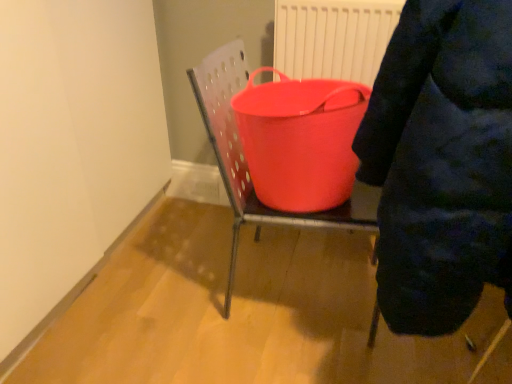
Where is `vacant region to the left of rubberized plastic bucket at center`? vacant region to the left of rubberized plastic bucket at center is located at coordinates (x=172, y=284).